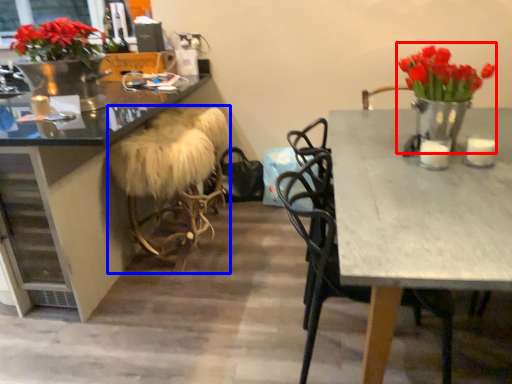
Question: Which object appears farthest to the camera in this image, floral arrangement (highlighted by a red box) or stool (highlighted by a blue box)?

Choices:
 (A) floral arrangement
 (B) stool

Answer: (B)